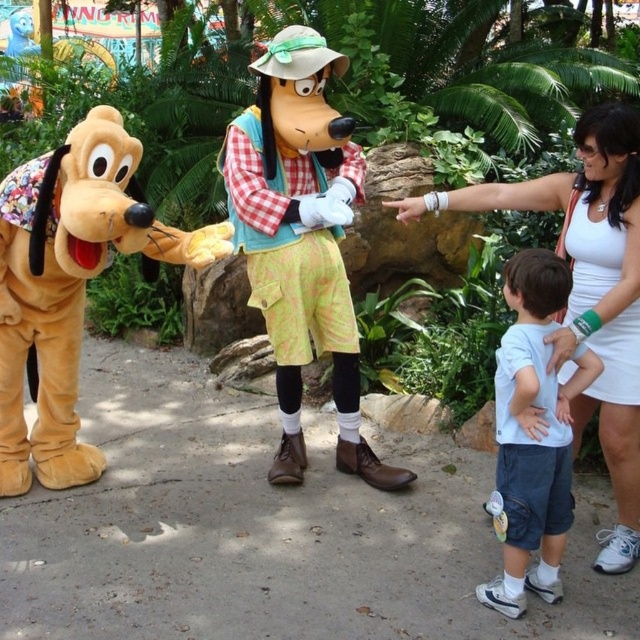
Question: Which point appears farthest from the camera in this image?

Choices:
 (A) (529, 417)
 (B) (609, 243)
 (C) (630, 244)
 (D) (236, 122)

Answer: (D)

Question: Which object is the closest to the white fabric at right?

Choices:
 (A) checkered fabric shirt at center
 (B) white matte tank top at right

Answer: (B)

Question: Is light blue t-shirt at center further to the viewer compared to checkered fabric shirt at center?

Choices:
 (A) yes
 (B) no

Answer: (B)

Question: Among these objects, which one is nearest to the camera?

Choices:
 (A) checkered fabric shirt at center
 (B) white matte tank top at right
 (C) white fabric at right
 (D) light blue t-shirt at center

Answer: (D)

Question: Can you confirm if white fabric at right is bigger than white matte tank top at right?

Choices:
 (A) no
 (B) yes

Answer: (B)

Question: Considering the relative positions of white fabric at right and white matte tank top at right in the image provided, where is white fabric at right located with respect to white matte tank top at right?

Choices:
 (A) right
 (B) left

Answer: (B)